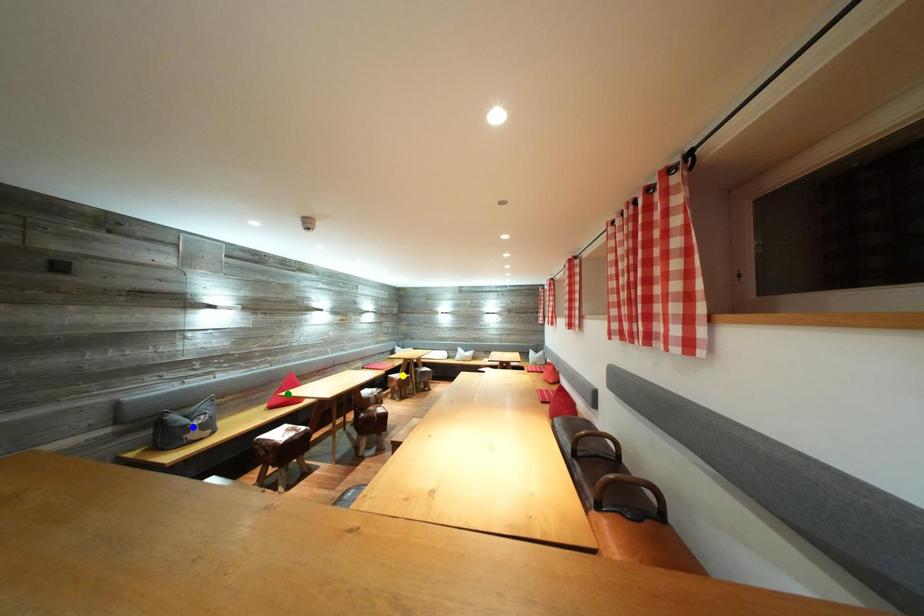
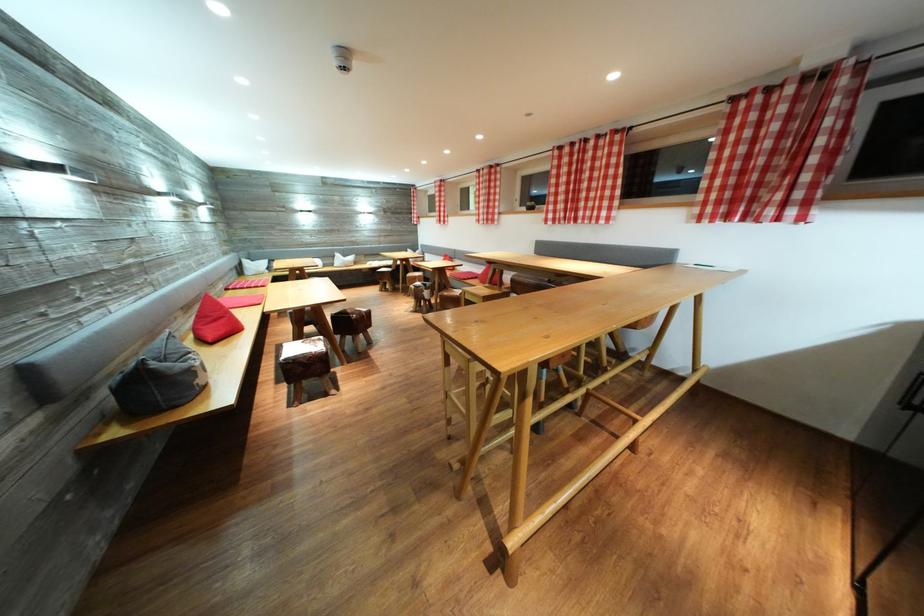
I am providing you with two images of the same scene from different viewpoints. Three points are marked in image1. Which point corresponds to a part or object that is occluded in image2?In image1, three points are marked. Which of them correspond to a part or object that is occluded in image2?Among the three points shown in image1, which one corresponds to a part or object that is no longer visible due to occlusion in image2?

yellow point cannot be seen in image2.